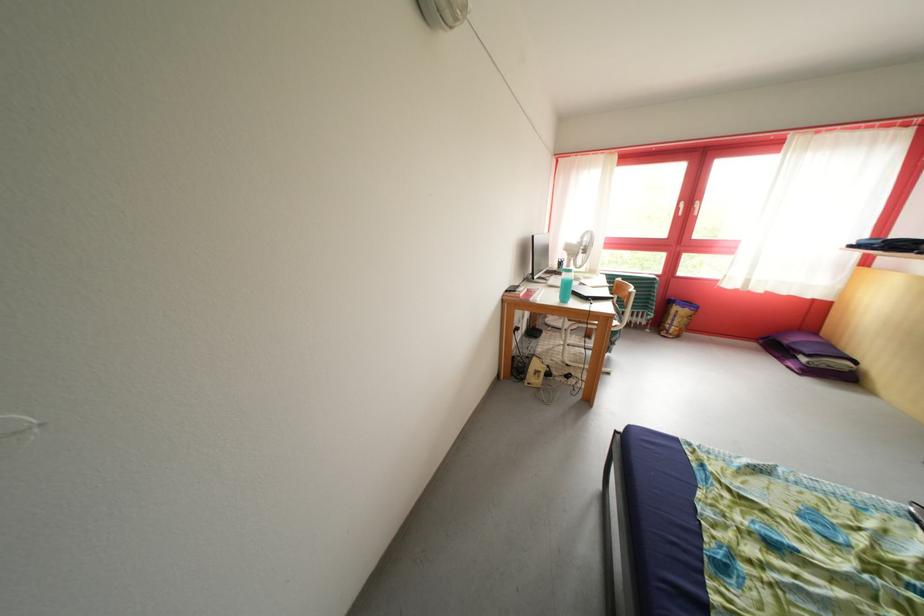
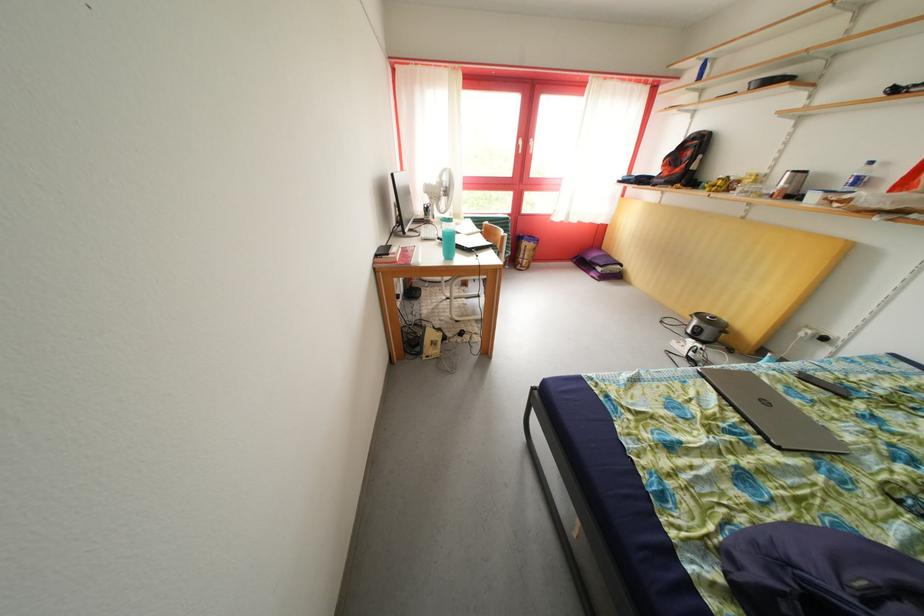
Locate, in the second image, the point that corresponds to the point at 638,299 in the first image.

(511, 243)